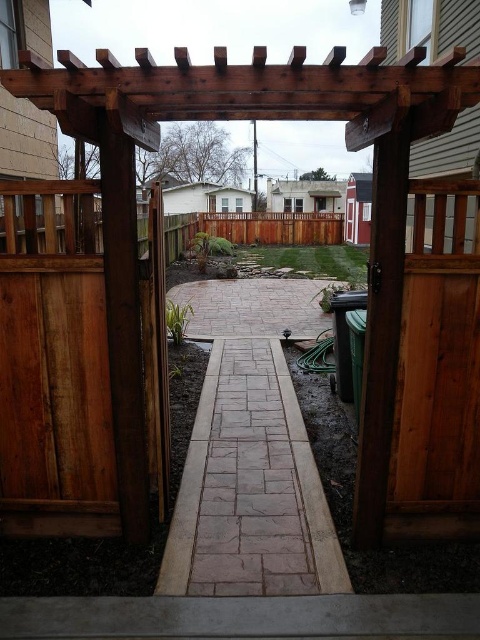
Question: Does brown stone path at center appear over brown wooden fence at center?

Choices:
 (A) no
 (B) yes

Answer: (A)

Question: Is brown stone path at center above brown wooden fence at center?

Choices:
 (A) yes
 (B) no

Answer: (B)

Question: Is brown stone path at center further to the viewer compared to brown wooden fence at center?

Choices:
 (A) no
 (B) yes

Answer: (A)

Question: Which object appears farthest from the camera in this image?

Choices:
 (A) brown wooden fence at center
 (B) brown stone path at center

Answer: (A)

Question: Which object is closer to the camera taking this photo?

Choices:
 (A) brown wooden fence at center
 (B) brown stone path at center

Answer: (B)